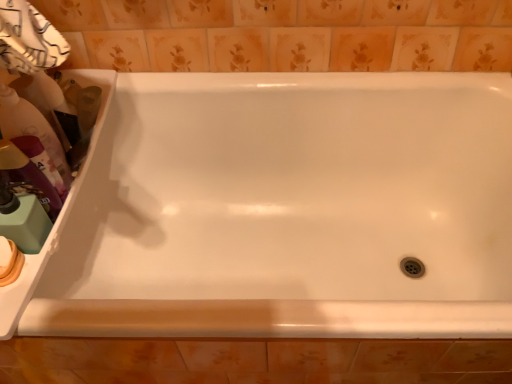
Locate an element on the screen. The height and width of the screenshot is (384, 512). free location to the right of beige matte soap at lower left is located at coordinates (50, 301).